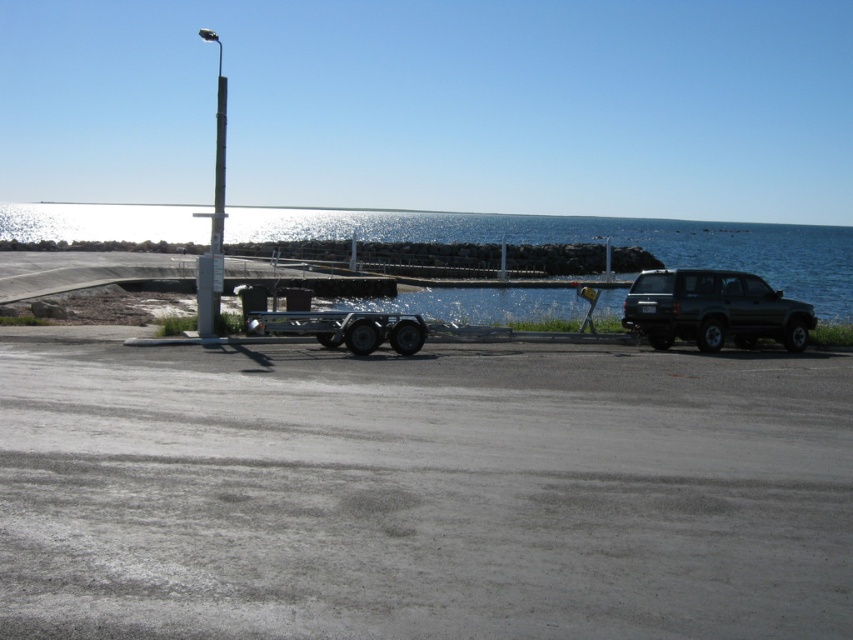
You are standing at the camera position looking at the coastal scene. There are two points marked in the image, one at coordinate point [639,512] and another at point [390,320]. Which point is nearer to you?

Point [639,512] is closer to the camera than point [390,320], so the point at [639,512] is nearer to you.

From the picture: You are standing at point (216, 211) and want to walk to the parking lot entrance located at point (231, 612). Is the parking lot entrance in front of you or behind you?

The parking lot entrance at point (231, 612) is in front of you because it is in front of point (216, 211) where you are standing.